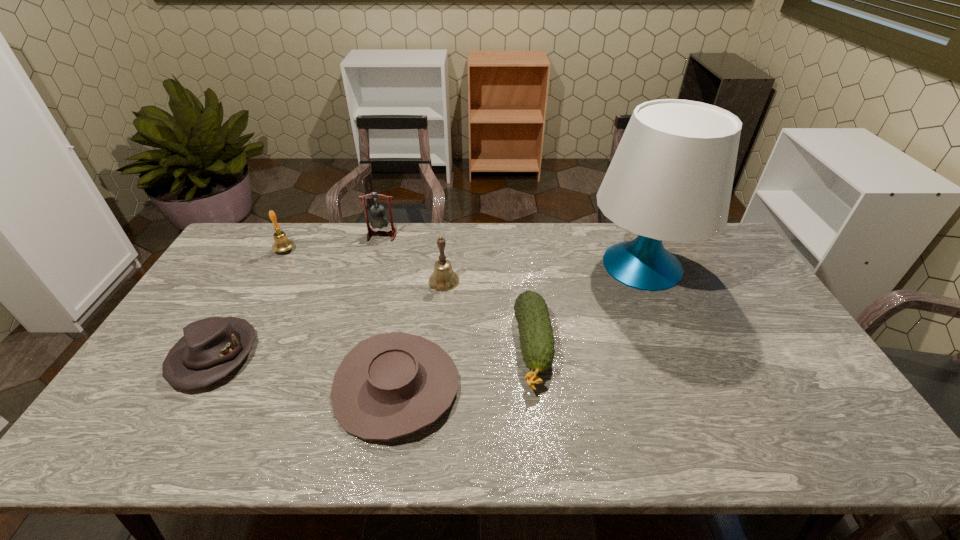
Locate an element on the screen. The height and width of the screenshot is (540, 960). table lamp is located at coordinates (671, 177).

Identify the location of the rightmost object. The height and width of the screenshot is (540, 960). (671, 177).

Identify the location of the second bell from left to right. Image resolution: width=960 pixels, height=540 pixels. point(379,220).

The width and height of the screenshot is (960, 540). In order to click on the nearest bell in this screenshot , I will do `click(443, 278)`.

Where is `the second farthest bell`? Image resolution: width=960 pixels, height=540 pixels. the second farthest bell is located at coordinates (281, 243).

Where is `hat`? The image size is (960, 540). hat is located at coordinates (211, 348).

Find the location of a particular element. the second object from right to left is located at coordinates (536, 337).

Where is `cowboy hat`? cowboy hat is located at coordinates 390,385.

Locate an element on the screen. This screenshot has height=540, width=960. free point located 0.190m on the front-facing side of the table lamp is located at coordinates (529, 266).

Identify the location of free space located on the front-facing side of the table lamp. This screenshot has width=960, height=540. (562, 266).